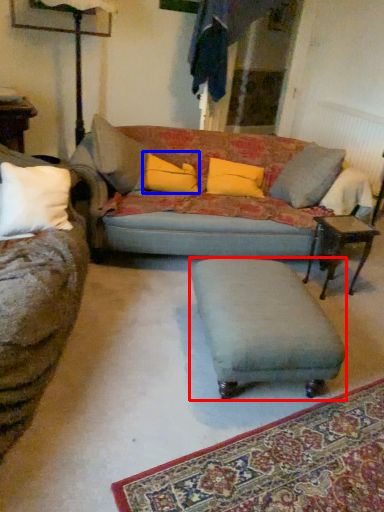
Question: Which point is closer to the camera, footrest (highlighted by a red box) or pillow (highlighted by a blue box)?

Choices:
 (A) footrest
 (B) pillow

Answer: (A)